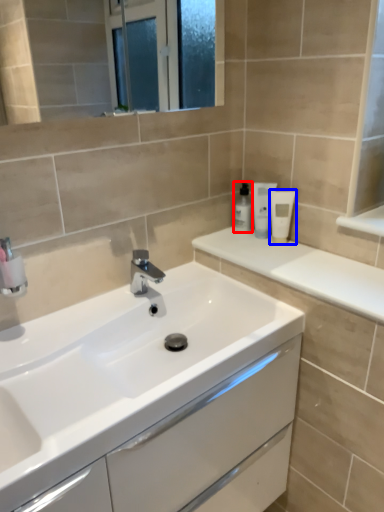
Question: Among these objects, which one is nearest to the camera, toiletry (highlighted by a red box) or toiletry (highlighted by a blue box)?

Choices:
 (A) toiletry
 (B) toiletry

Answer: (B)